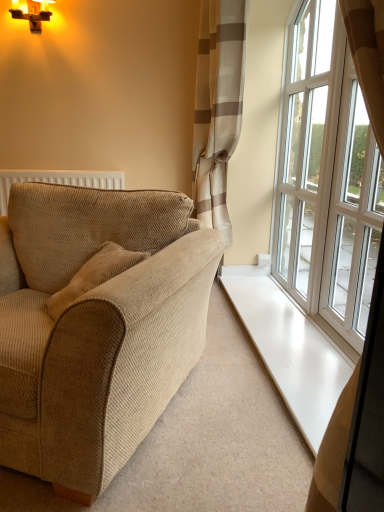
Question: Does white glass window at right, positioned as the second window in back-to-front order, have a lesser height compared to beige corduroy couch at left?

Choices:
 (A) no
 (B) yes

Answer: (A)

Question: Is white glass window at right, positioned as the second window in back-to-front order, not inside beige corduroy couch at left?

Choices:
 (A) yes
 (B) no

Answer: (A)

Question: Is white glass window at right, which is the first window from front to back, to the right of beige corduroy couch at left from the viewer's perspective?

Choices:
 (A) no
 (B) yes

Answer: (B)

Question: Can you confirm if white glass window at right, which is the first window from front to back, is bigger than beige corduroy couch at left?

Choices:
 (A) no
 (B) yes

Answer: (A)

Question: From a real-world perspective, is white glass window at right, positioned as the second window in back-to-front order, below beige corduroy couch at left?

Choices:
 (A) yes
 (B) no

Answer: (B)

Question: From a real-world perspective, is white glass window at right, which is the first window from front to back, over beige corduroy couch at left?

Choices:
 (A) no
 (B) yes

Answer: (B)

Question: Can you confirm if white glass window at right, which is counted as the 1th window, starting from the back, is shorter than white glass window at right, which is the first window from front to back?

Choices:
 (A) yes
 (B) no

Answer: (B)

Question: Is white glass window at right, which is counted as the 1th window, starting from the back, at the right side of white glass window at right, which is the first window from front to back?

Choices:
 (A) yes
 (B) no

Answer: (B)

Question: Is white glass window at right, acting as the 2th window starting from the front, closer to the viewer compared to white glass window at right, which is the first window from front to back?

Choices:
 (A) no
 (B) yes

Answer: (A)

Question: Is white glass window at right, which is counted as the 1th window, starting from the back, facing away from white glass window at right, which is the first window from front to back?

Choices:
 (A) yes
 (B) no

Answer: (B)

Question: Is white glass window at right, which is counted as the 1th window, starting from the back, not inside white glass window at right, which is the first window from front to back?

Choices:
 (A) no
 (B) yes

Answer: (B)

Question: From a real-world perspective, is white glass window at right, acting as the 2th window starting from the front, physically below white glass window at right, which is the first window from front to back?

Choices:
 (A) yes
 (B) no

Answer: (B)

Question: Does beige corduroy couch at left have a larger size compared to white glass window at right, acting as the 2th window starting from the front?

Choices:
 (A) yes
 (B) no

Answer: (A)